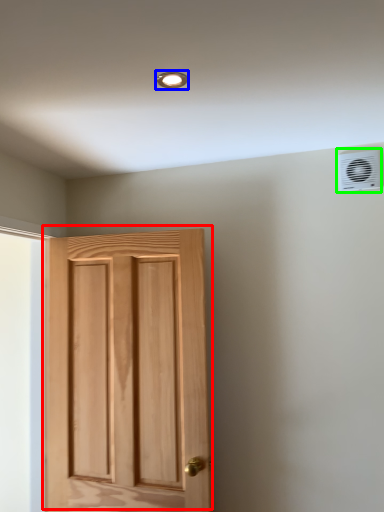
Question: Which is farther away from door (highlighted by a red box)? light fixture (highlighted by a blue box) or air conditioning (highlighted by a green box)?

Choices:
 (A) light fixture
 (B) air conditioning

Answer: (A)